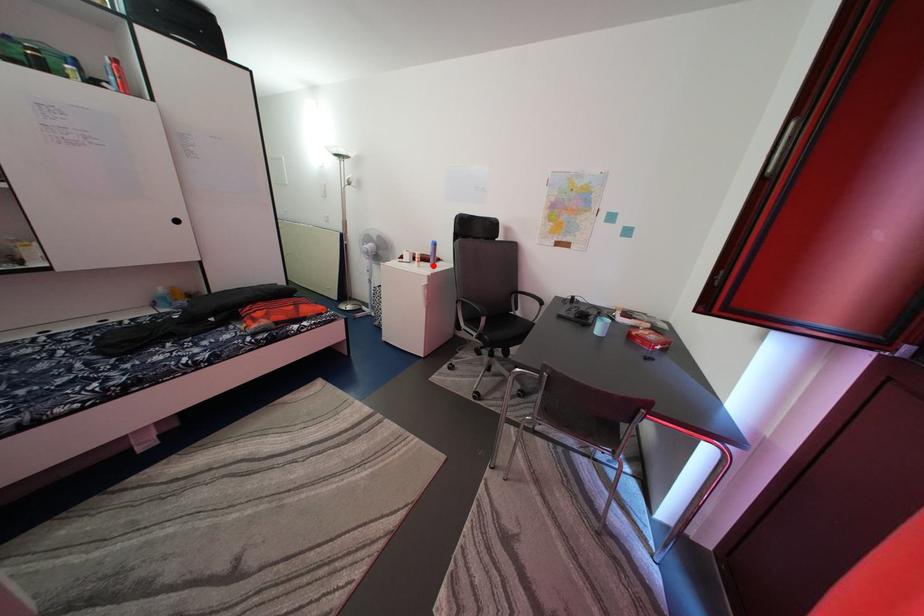
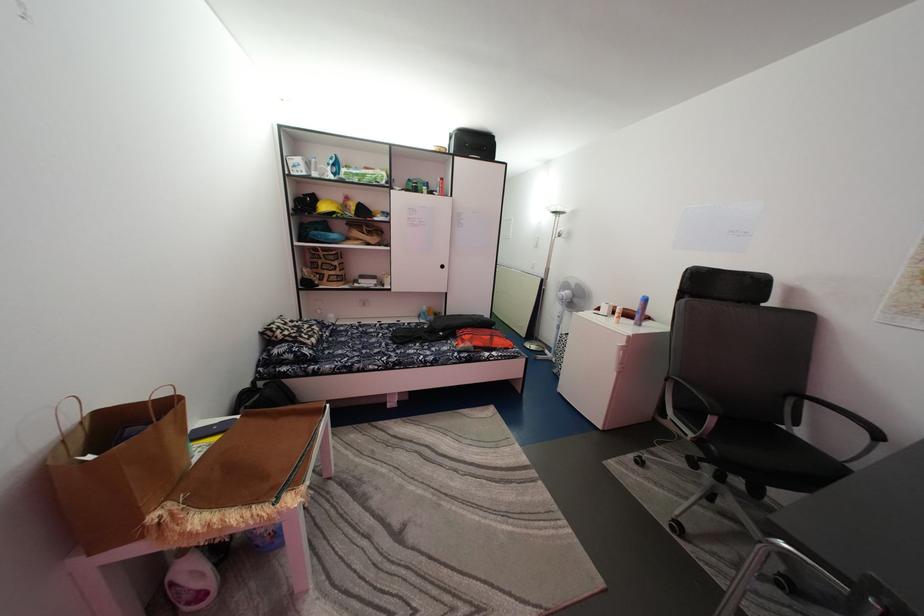
Question: I am providing you with two images of the same scene from different viewpoints. A red point is marked on the first image. Can you still see the location of the red point in image 2?

Choices:
 (A) Yes
 (B) No

Answer: (A)